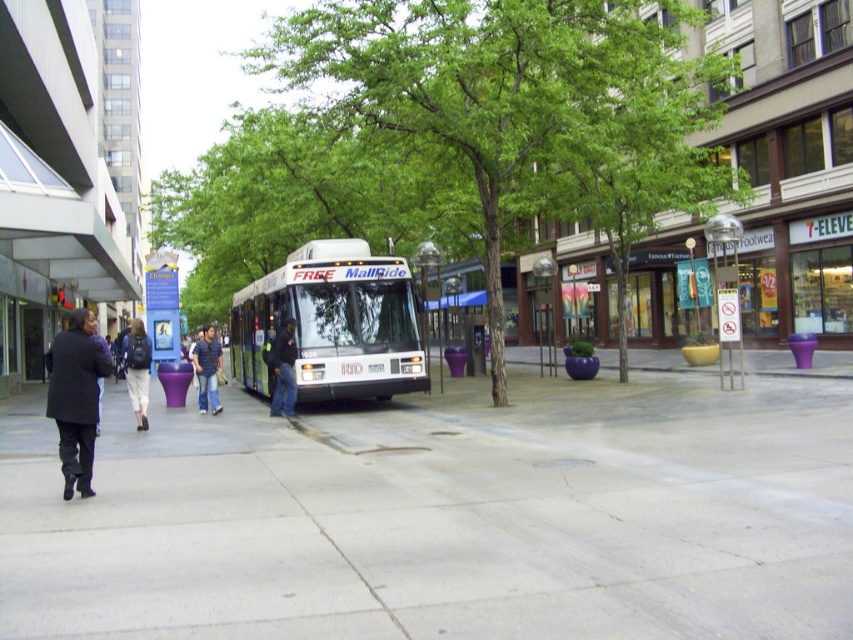
At what (x,y) coordinates should I click in order to perform the action: click on green leafy tree at center. Please return your answer as a coordinate pair (x, y). The width and height of the screenshot is (853, 640). Looking at the image, I should click on (521, 115).

Does green leafy tree at center come behind black matte coat at left?

Yes, green leafy tree at center is behind black matte coat at left.

The height and width of the screenshot is (640, 853). What are the coordinates of `green leafy tree at center` in the screenshot? It's located at (521, 115).

Between light beige pants at center and dark blue jeans at center, which one has less height?

Standing shorter between the two is dark blue jeans at center.

Looking at this image, does light beige pants at center have a lesser height compared to dark blue jeans at center?

No.

Which is in front, point (140, 403) or point (287, 356)?

Point (140, 403) is in front.

You are a GUI agent. You are given a task and a screenshot of the screen. Output one action in this format:
    pyautogui.click(x=<x>, y=<y>)
    Task: Click on the light beige pants at center
    Image resolution: width=853 pixels, height=640 pixels.
    Given the screenshot: What is the action you would take?
    pyautogui.click(x=137, y=369)

Does green leafy tree at center appear under light beige pants at center?

Actually, green leafy tree at center is above light beige pants at center.

Is green leafy tree at center wider than light beige pants at center?

Yes.

Is point (624, 342) positioned after point (129, 385)?

Yes, it is.

This screenshot has height=640, width=853. Identify the location of green leafy tree at center. (521, 115).